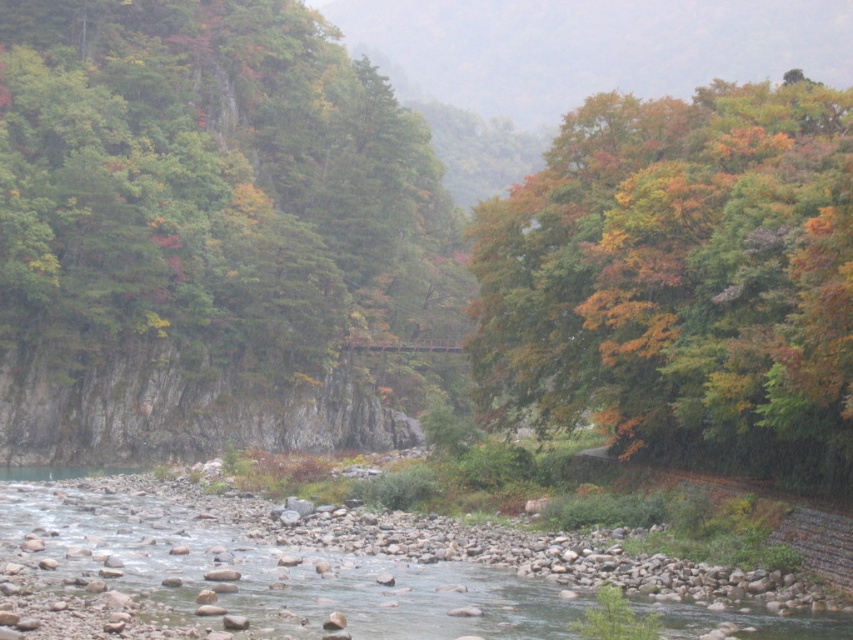
Question: Which point is farther to the camera?

Choices:
 (A) multicolored foliage at upper right
 (B) green matte tree at upper left

Answer: (B)

Question: From the image, what is the correct spatial relationship of green matte tree at upper left in relation to multicolored foliage at upper right?

Choices:
 (A) right
 (B) left

Answer: (B)

Question: Does green matte tree at upper left lie behind multicolored foliage at upper right?

Choices:
 (A) no
 (B) yes

Answer: (B)

Question: Does green matte tree at upper left have a greater width compared to multicolored foliage at upper right?

Choices:
 (A) yes
 (B) no

Answer: (A)